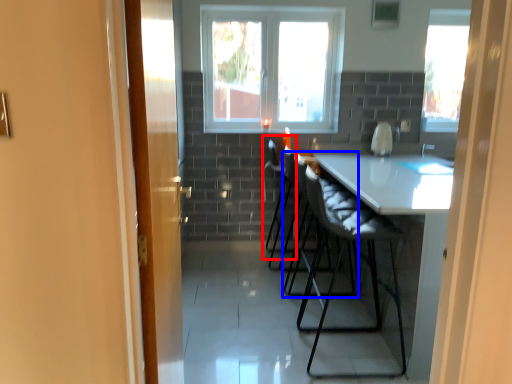
Question: Which point is closer to the camera, chair (highlighted by a red box) or folding chair (highlighted by a blue box)?

Choices:
 (A) chair
 (B) folding chair

Answer: (B)